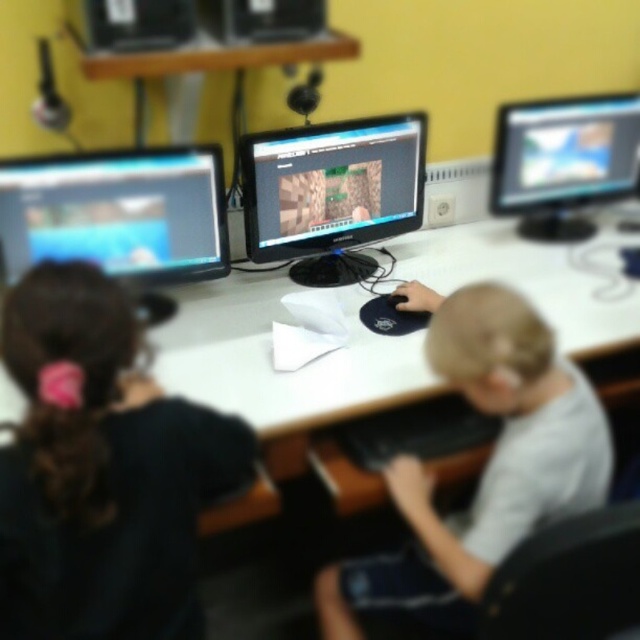
You need to place a new keyboard on the white glossy computer desk at center. Considering the desk and the matte black monitor at center, will there be enough space for the keyboard to the left of the monitor?

The white glossy computer desk at center might be wider than matte black monitor at center, so there could be enough space to place the keyboard to the left of the matte black monitor at center.

Based on the scene description, can you determine the spatial relationship between the light gray shirt at center and the matte black monitor at center?

The light gray shirt at center is located below the matte black monitor at center.